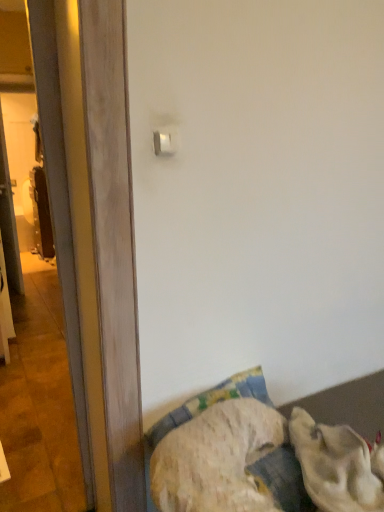
Question: From a real-world perspective, is white plastic light switch at upper center physically located above or below transparent glass screen door at left?

Choices:
 (A) below
 (B) above

Answer: (B)

Question: Based on their sizes in the image, would you say white plastic light switch at upper center is bigger or smaller than transparent glass screen door at left?

Choices:
 (A) big
 (B) small

Answer: (B)

Question: Based on their relative distances, which object is nearer to the transparent glass screen door at left?

Choices:
 (A) fluffy fabric bed at lower right
 (B) white plastic light switch at upper center
 (C) white fluffy dog at lower right

Answer: (B)

Question: Which object is positioned farthest from the fluffy fabric bed at lower right?

Choices:
 (A) white plastic light switch at upper center
 (B) transparent glass screen door at left
 (C) white fluffy dog at lower right

Answer: (A)